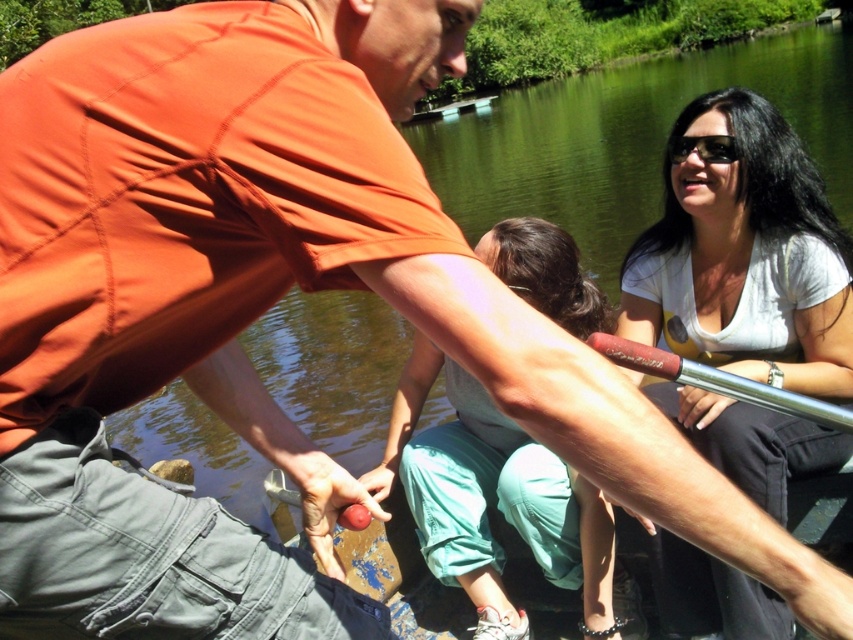
You are a photographer standing on the shore of the lake. You want to take a photo of the white matte shirt at upper right and the rubberized red paddle at center. Which object should you zoom in on to capture more details?

A: The white matte shirt at upper right has a larger size compared to the rubberized red paddle at center, so you should zoom in on the rubberized red paddle at center to capture more details since it is smaller and requires closer focus.